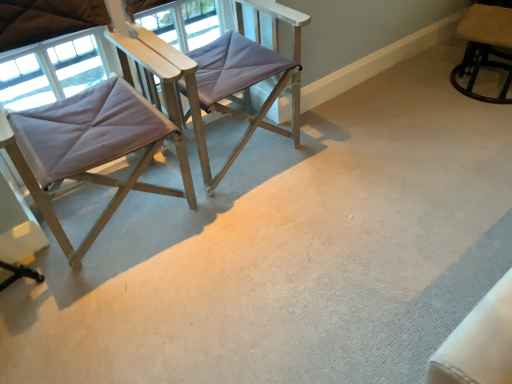
Question: Considering the positions of matte purple fabric chair at center, marked as the 2th chair in a right-to-left arrangement, and matte gray fabric chair at left, marked as the first chair in a left-to-right arrangement, in the image, is matte purple fabric chair at center, marked as the 2th chair in a right-to-left arrangement, wider or thinner than matte gray fabric chair at left, marked as the first chair in a left-to-right arrangement,?

Choices:
 (A) wide
 (B) thin

Answer: (A)

Question: In the image, is matte purple fabric chair at center, marked as the second chair in a left-to-right arrangement, positioned in front of or behind matte gray fabric chair at left, placed as the 3th chair when sorted from right to left?

Choices:
 (A) front
 (B) behind

Answer: (B)

Question: Estimate the real-world distances between objects in this image. Which object is farther from the beige fabric chair at upper right, the first chair when ordered from right to left?

Choices:
 (A) matte gray fabric chair at left, marked as the first chair in a left-to-right arrangement
 (B) matte purple fabric chair at center, marked as the 2th chair in a right-to-left arrangement

Answer: (A)

Question: Which of these objects is positioned closest to the matte purple fabric chair at center, marked as the second chair in a left-to-right arrangement?

Choices:
 (A) matte gray fabric chair at left, marked as the first chair in a left-to-right arrangement
 (B) beige fabric chair at upper right, which is counted as the 3th chair, starting from the left

Answer: (A)